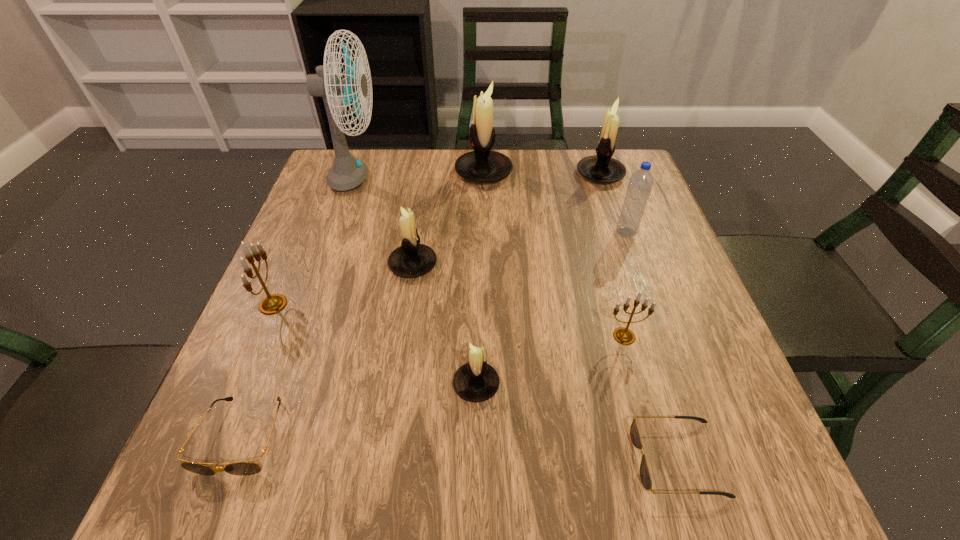
Locate an element on the screen. free spot between the second biggest white candle holder and the smallest white candle holder is located at coordinates (539, 279).

You are a GUI agent. You are given a task and a screenshot of the screen. Output one action in this format:
    pyautogui.click(x=<x>, y=<y>)
    Task: Click on the free space that is in between the blue water bottle and the left black sunglasses
    This screenshot has width=960, height=540.
    Given the screenshot: What is the action you would take?
    pyautogui.click(x=434, y=334)

Where is `vacant area that lies between the fifth nearest object and the smaller gold candelabrum`? vacant area that lies between the fifth nearest object and the smaller gold candelabrum is located at coordinates pyautogui.click(x=448, y=320).

Find the location of `free spot between the bigger gold candelabrum and the fourth farthest object`. free spot between the bigger gold candelabrum and the fourth farthest object is located at coordinates (449, 268).

Image resolution: width=960 pixels, height=540 pixels. What are the coordinates of `free area in between the right gold candelabrum and the left black sunglasses` in the screenshot? It's located at (433, 386).

Find the location of a particular element. unoccupied position between the seventh nearest object and the bigger gold candelabrum is located at coordinates (449, 268).

The image size is (960, 540). I want to click on the seventh closest object to the left black sunglasses, so click(482, 165).

Identify which object is located as the ninth nearest to the gray fan. Please provide its 2D coordinates. Your answer should be formatted as a tuple, i.e. [(x, y)], where the tuple contains the x and y coordinates of a point satisfying the conditions above.

[(645, 476)]

Where is `candle holder that is the fifth closest to the fan`? The image size is (960, 540). candle holder that is the fifth closest to the fan is located at coordinates pyautogui.click(x=601, y=168).

Where is `candle holder that is the fourth nearest to the left sunglasses`? The image size is (960, 540). candle holder that is the fourth nearest to the left sunglasses is located at coordinates (622, 335).